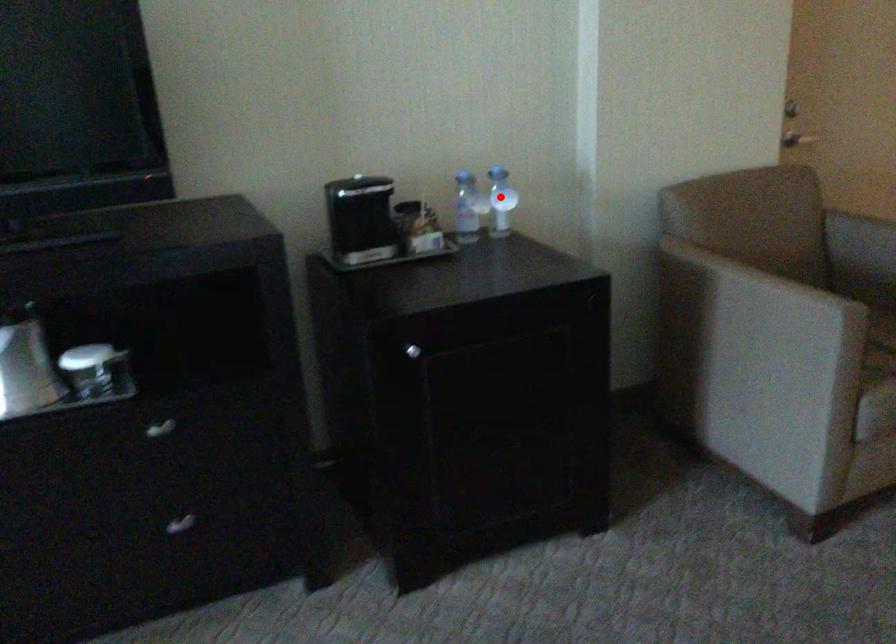
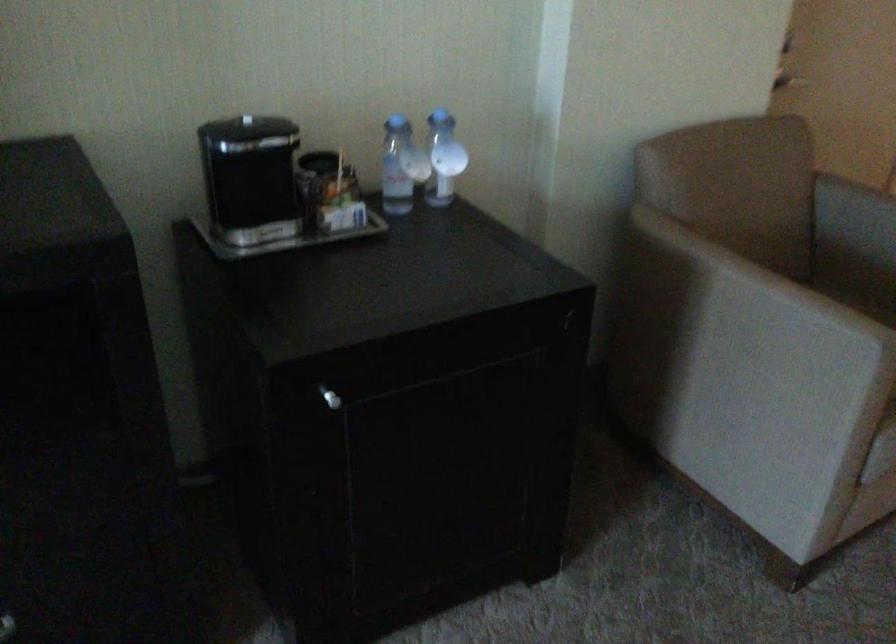
Question: I am providing you with two images of the same scene from different viewpoints. Image1 has a red point marked. In image2, the corresponding 3D location appears at what relative position? Reply with the corresponding letter.

Choices:
 (A) Closer
 (B) Farther

Answer: (A)